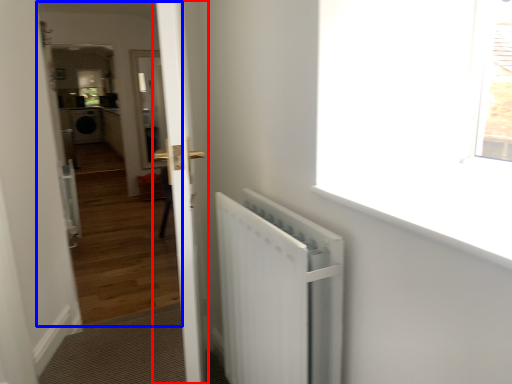
Question: Which point is closer to the camera, door (highlighted by a red box) or corridor (highlighted by a blue box)?

Choices:
 (A) door
 (B) corridor

Answer: (A)